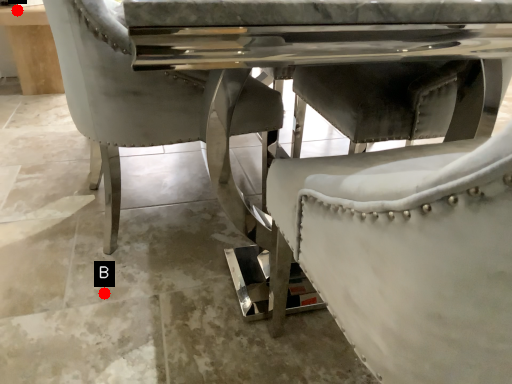
Question: Two points are circled on the image, labeled by A and B beside each circle. Which of the following is the closest to the observer?

Choices:
 (A) A is closer
 (B) B is closer

Answer: (B)